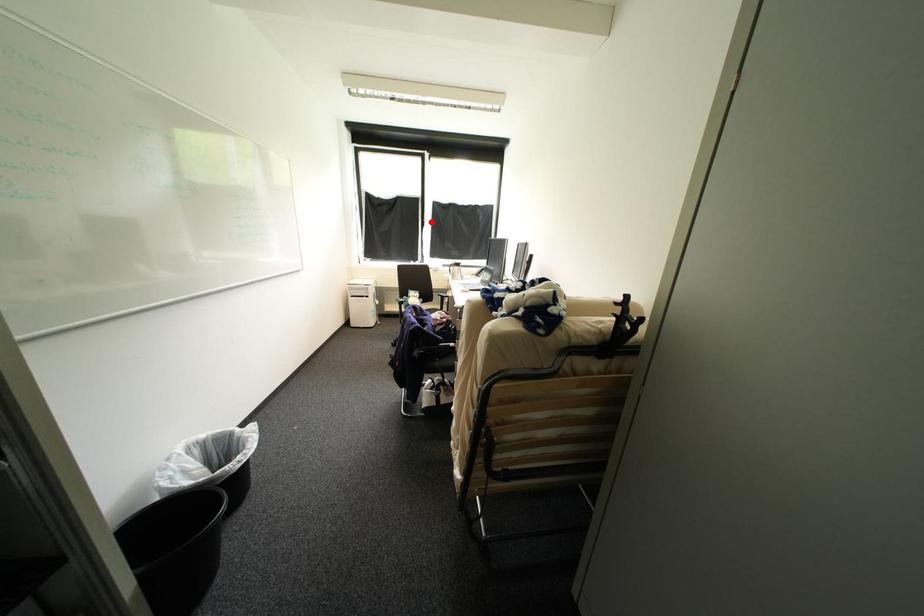
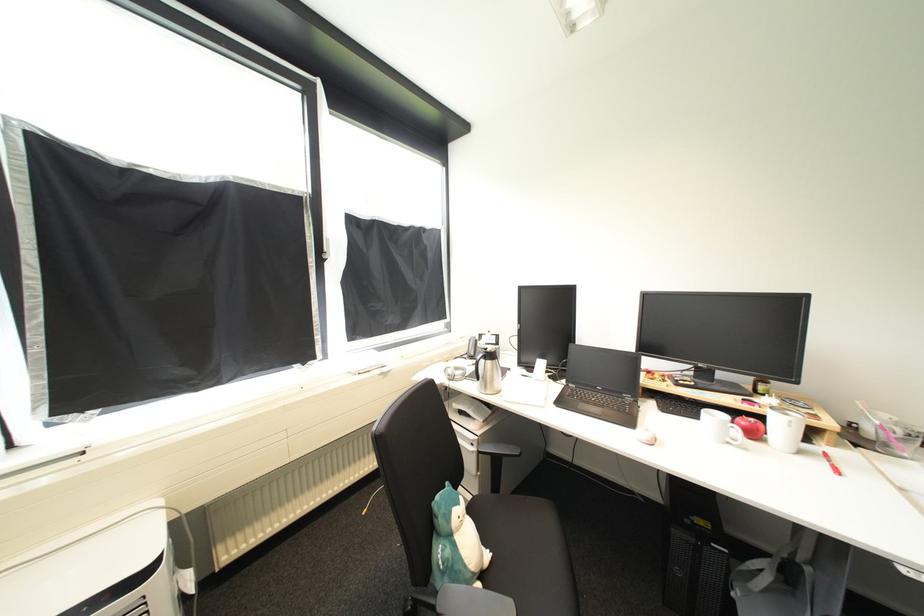
Question: A red point is marked in image1. In image2, is the corresponding 3D point closer to the camera or farther? Reply with the corresponding letter.

Choices:
 (A) The corresponding 3D point is closer.
 (B) The corresponding 3D point is farther.

Answer: (B)